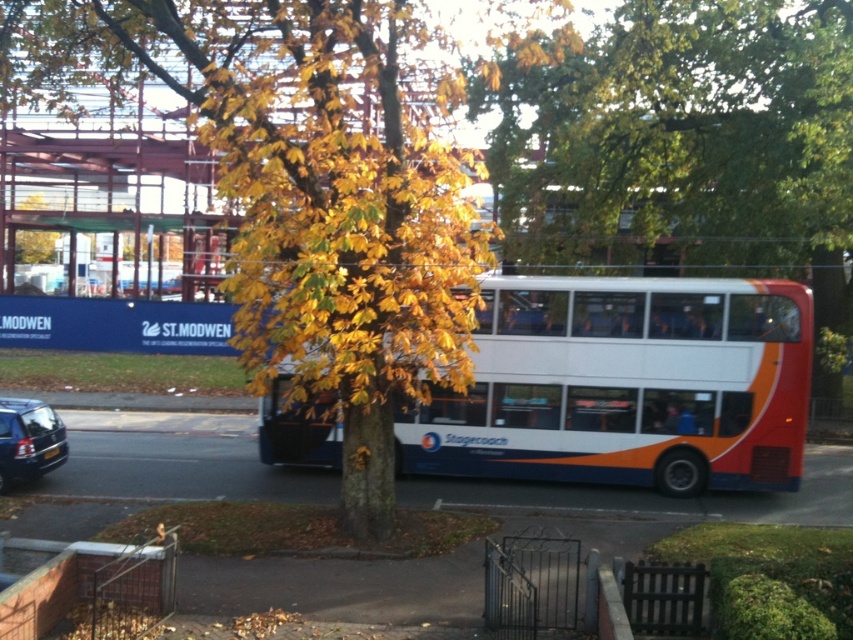
Is the position of white/orange/blue stagecoach bus at center more distant than that of matte black car at lower left?

Yes, white/orange/blue stagecoach bus at center is further from the viewer.

What do you see at coordinates (625, 385) in the screenshot?
I see `white/orange/blue stagecoach bus at center` at bounding box center [625, 385].

Locate an element on the screen. The image size is (853, 640). white/orange/blue stagecoach bus at center is located at coordinates (625, 385).

Is yellow-green leaves at center below white/orange/blue stagecoach bus at center?

Incorrect, yellow-green leaves at center is not positioned below white/orange/blue stagecoach bus at center.

Does point (259, 104) lie behind point (628, 330)?

No, it is not.

You are a GUI agent. You are given a task and a screenshot of the screen. Output one action in this format:
    pyautogui.click(x=<x>, y=<y>)
    Task: Click on the yellow-green leaves at center
    The height and width of the screenshot is (640, 853).
    Given the screenshot: What is the action you would take?
    pyautogui.click(x=308, y=189)

Can you confirm if yellow-green leaves at center is shorter than matte black car at lower left?

In fact, yellow-green leaves at center may be taller than matte black car at lower left.

Who is lower down, yellow-green leaves at center or matte black car at lower left?

matte black car at lower left is below.

Describe the element at coordinates (308, 189) in the screenshot. I see `yellow-green leaves at center` at that location.

This screenshot has height=640, width=853. What are the coordinates of `yellow-green leaves at center` in the screenshot? It's located at (308, 189).